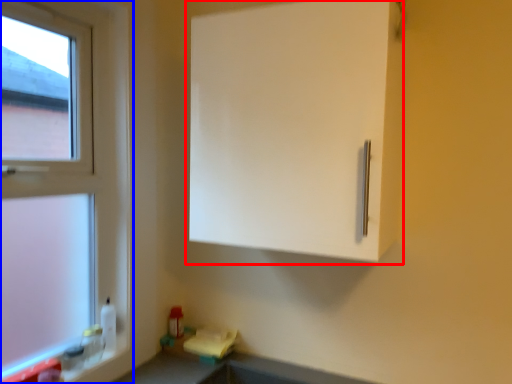
Question: Which point is further to the camera, cabinetry (highlighted by a red box) or window (highlighted by a blue box)?

Choices:
 (A) cabinetry
 (B) window

Answer: (B)